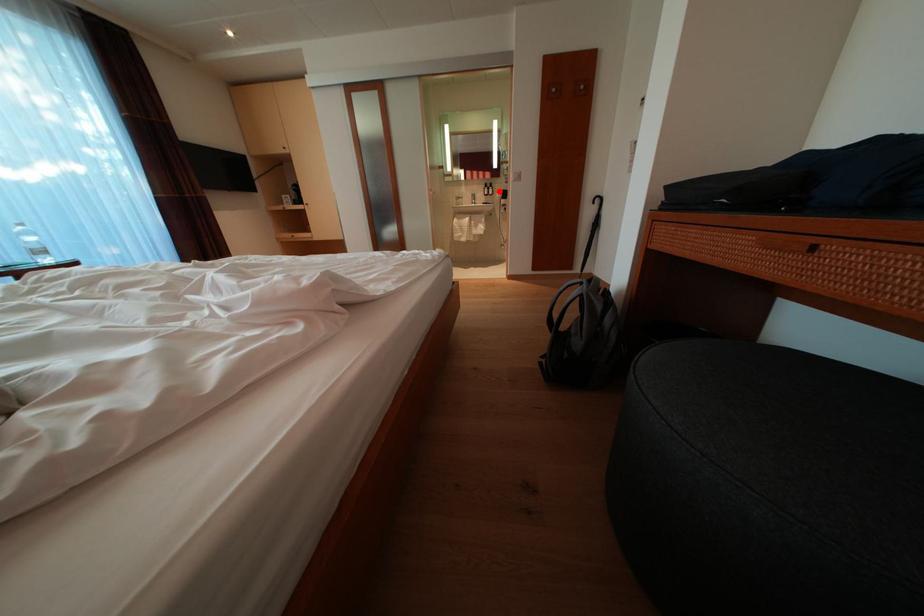
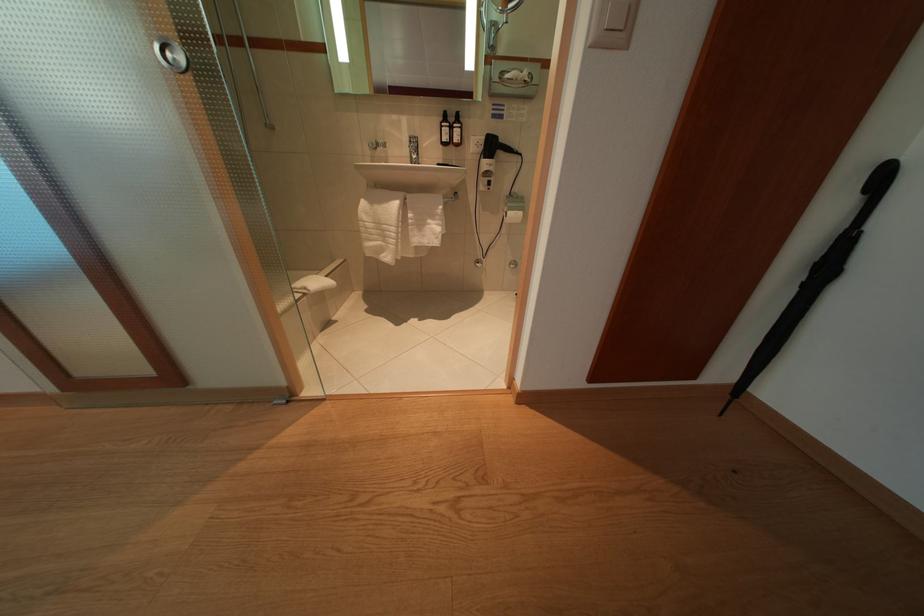
The point at the highlighted location is marked in the first image. Where is the corresponding point in the second image?

(466, 124)